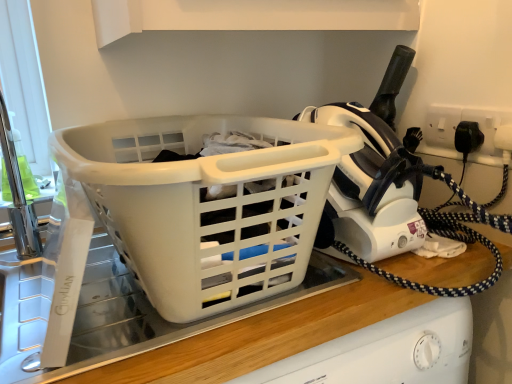
At what (x,y) coordinates should I click in order to perform the action: click on white plastic iron at upper right. Please return your answer as a coordinate pair (x, y). The height and width of the screenshot is (384, 512). Looking at the image, I should click on pyautogui.click(x=392, y=197).

Image resolution: width=512 pixels, height=384 pixels. I want to click on white plastic iron at upper right, so click(x=374, y=173).

At what (x,y) coordinates should I click in order to perform the action: click on white plastic socket at upper right. Please return your answer as a coordinate pair (x, y). The image size is (512, 384). Looking at the image, I should click on (456, 127).

Identify the location of white plastic iron at upper right. The width and height of the screenshot is (512, 384). (392, 197).

From the image's perspective, between white plastic iron at upper right and white plastic basket at center, who is located below?

white plastic basket at center.

Is white plastic iron at upper right smaller than white plastic basket at center?

Correct, white plastic iron at upper right occupies less space than white plastic basket at center.

This screenshot has width=512, height=384. I want to click on appliance above the white plastic basket at center (from the image's perspective), so click(374, 173).

Can you tell me how much white plastic iron at upper right and white plastic basket at center differ in facing direction?

The angle between the facing direction of white plastic iron at upper right and the facing direction of white plastic basket at center is 2.42 degrees.

What's the angular difference between white plastic iron at upper right and white plastic basket at center's facing directions?

They differ by 2.04 degrees in their facing directions.

From the picture: From a real-world perspective, is white plastic iron at upper right physically above white plastic basket at center?

Indeed, from a real-world perspective, white plastic iron at upper right stands above white plastic basket at center.

Are white plastic iron at upper right and white plastic basket at center far apart?

They are positioned close to each other.

Considering the points (337, 212) and (297, 195), which point is behind, point (337, 212) or point (297, 195)?

The point (337, 212) is more distant.

Is white plastic iron at upper right completely or partially outside of white plastic socket at upper right?

white plastic iron at upper right is positioned outside white plastic socket at upper right.

Is white plastic iron at upper right positioned with its back to white plastic socket at upper right?

No.

Considering the sizes of objects white plastic iron at upper right and white plastic socket at upper right in the image provided, who is thinner, white plastic iron at upper right or white plastic socket at upper right?

white plastic socket at upper right.

The width and height of the screenshot is (512, 384). In order to click on appliance above the white plastic socket at upper right (from a real-world perspective) in this screenshot , I will do `click(374, 173)`.

Where is `basket below the white plastic iron at upper right (from a real-world perspective)`? basket below the white plastic iron at upper right (from a real-world perspective) is located at coordinates (206, 205).

Is the depth of white plastic basket at center greater than that of white plastic iron at upper right?

No, white plastic basket at center is in front of white plastic iron at upper right.

Between white plastic basket at center and white plastic iron at upper right, which one has smaller size?

With smaller size is white plastic iron at upper right.

Does white plastic iron at upper right have a lesser height compared to white plastic socket at upper right?

In fact, white plastic iron at upper right may be taller than white plastic socket at upper right.

Is white plastic iron at upper right oriented towards white plastic socket at upper right?

No.

Which is more to the left, white plastic iron at upper right or white plastic socket at upper right?

From the viewer's perspective, white plastic iron at upper right appears more on the left side.

Considering the relative sizes of white plastic iron at upper right and white plastic socket at upper right in the image provided, is white plastic iron at upper right wider than white plastic socket at upper right?

Yes, white plastic iron at upper right is wider than white plastic socket at upper right.

Would you say white plastic socket at upper right is outside white plastic iron at upper right?

Yes, white plastic socket at upper right is located beyond the bounds of white plastic iron at upper right.

From the picture: From the image's perspective, is white plastic socket at upper right above or below white plastic iron at upper right?

Based on their image positions, white plastic socket at upper right is located above white plastic iron at upper right.

From a real-world perspective, which object rests below the other?

white plastic iron at upper right, from a real-world perspective.

From the image's perspective, would you say white plastic socket at upper right is shown under white plastic iron at upper right?

Yes.

From a real-world perspective, who is located higher, white plastic socket at upper right or white plastic iron at upper right?

In real-world perspective, white plastic iron at upper right is above.

Is white plastic iron at upper right at the back of white plastic socket at upper right?

No.

Is white plastic socket at upper right smaller than white plastic iron at upper right?

Correct, white plastic socket at upper right occupies less space than white plastic iron at upper right.

The image size is (512, 384). Find the location of `basket below the white plastic iron at upper right (from the image's perspective)`. basket below the white plastic iron at upper right (from the image's perspective) is located at coordinates (206, 205).

Where is `home appliance behind the white plastic basket at center`? This screenshot has width=512, height=384. home appliance behind the white plastic basket at center is located at coordinates (392, 197).

When comparing their distances from white plastic basket at center, does white plastic iron at upper right or white plastic iron at upper right seem closer?

white plastic iron at upper right.

Looking at the image, which one is located further to white plastic iron at upper right, white plastic socket at upper right or white plastic basket at center?

white plastic socket at upper right.

When comparing their distances from white plastic socket at upper right, does white plastic iron at upper right or white plastic iron at upper right seem further?

Based on the image, white plastic iron at upper right appears to be further to white plastic socket at upper right.

From the image, which object appears to be nearer to white plastic socket at upper right, white plastic iron at upper right or white plastic basket at center?

The object closer to white plastic socket at upper right is white plastic iron at upper right.

Looking at the image, which one is located further to white plastic basket at center, white plastic iron at upper right or white plastic iron at upper right?

Based on the image, white plastic iron at upper right appears to be further to white plastic basket at center.

When comparing their distances from white plastic iron at upper right, does white plastic socket at upper right or white plastic basket at center seem closer?

white plastic basket at center lies closer to white plastic iron at upper right than the other object.

Based on their spatial positions, is white plastic socket at upper right or white plastic iron at upper right further from white plastic iron at upper right?

The object further to white plastic iron at upper right is white plastic socket at upper right.

When comparing their distances from white plastic socket at upper right, does white plastic basket at center or white plastic iron at upper right seem closer?

Among the two, white plastic iron at upper right is located nearer to white plastic socket at upper right.

At what (x,y) coordinates should I click in order to perform the action: click on electric outlet between white plastic iron at upper right and white plastic iron at upper right along the z-axis. Please return your answer as a coordinate pair (x, y). This screenshot has width=512, height=384. Looking at the image, I should click on click(456, 127).

Where is `home appliance between white plastic basket at center and white plastic socket at upper right from left to right`? This screenshot has width=512, height=384. home appliance between white plastic basket at center and white plastic socket at upper right from left to right is located at coordinates (392, 197).

Locate an element on the screen. This screenshot has width=512, height=384. appliance between white plastic basket at center and white plastic socket at upper right in the horizontal direction is located at coordinates (374, 173).

Locate an element on the screen. This screenshot has width=512, height=384. appliance situated between white plastic basket at center and white plastic iron at upper right from left to right is located at coordinates (374, 173).